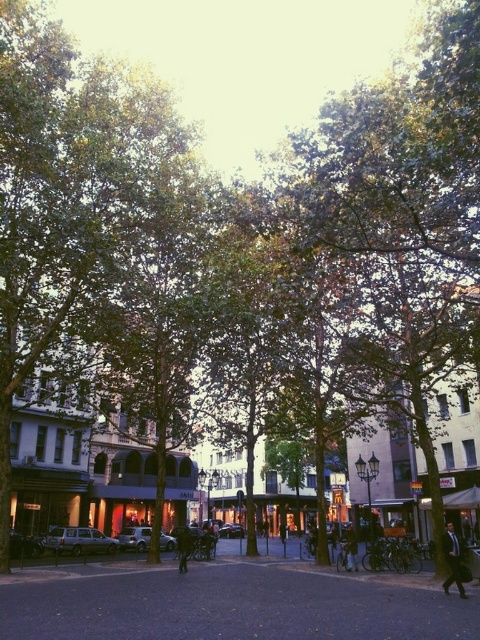
You are a photographer standing on the street and want to take a photo of the dark suit at center and the dark brown leather jacket at center. Which object should you focus on first if you want to capture both in the same frame without moving the camera?

The dark suit at center is much taller than the dark brown leather jacket at center, so you should focus on the dark suit at center first to ensure it is in focus before the jacket.